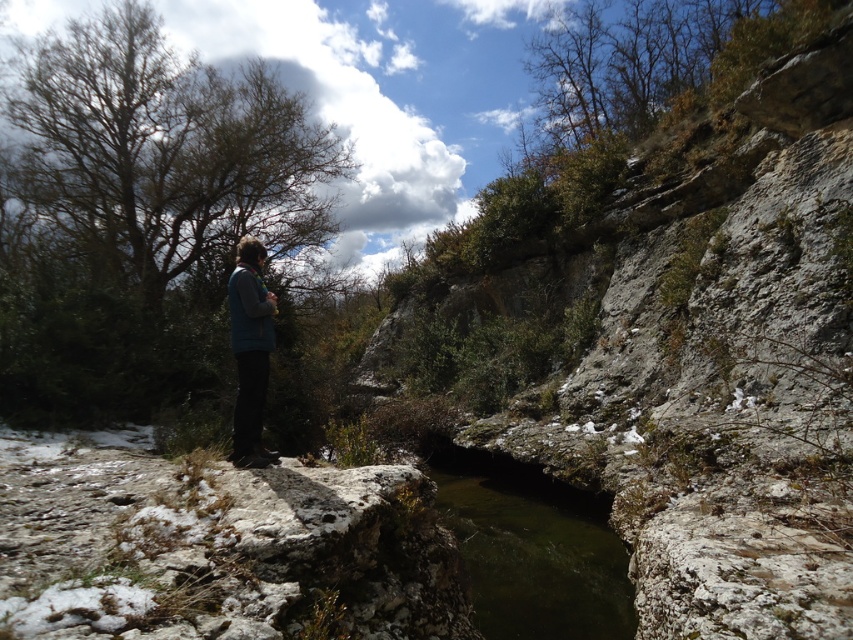
You are standing at the edge of a cliff and want to take a step back to avoid the cold stream wind. The rough stone hillside at center is behind you. Can you step back without falling off the cliff?

The rough stone hillside at center is 2.05 meters away from the viewer, so stepping back that distance would be safe as long as the terrain allows. However, the question mentions avoiding the cold stream wind, so stepping back 2.05 meters towards the hillside would move you away from the stream and its wind.